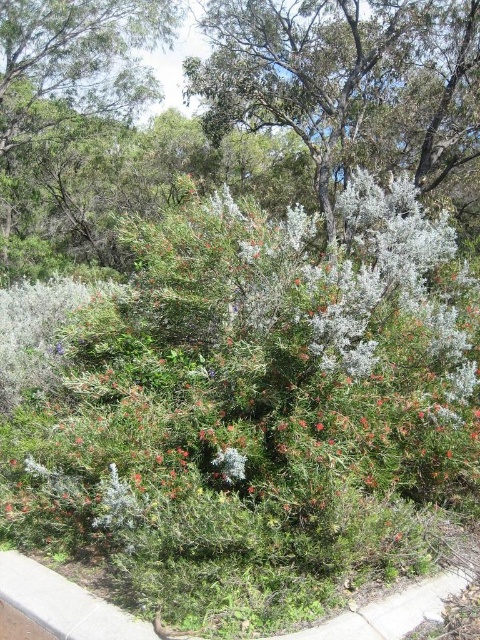
Who is more forward, [92,429] or [231,125]?

Point [92,429] is in front.

Does green leafy bush at center have a lesser height compared to white fluffy bush at upper center?

Incorrect, green leafy bush at center's height does not fall short of white fluffy bush at upper center's.

Does point (164, 273) lie in front of point (340, 172)?

Yes, it is.

The height and width of the screenshot is (640, 480). Find the location of `green leafy bush at center`. green leafy bush at center is located at coordinates (252, 387).

Which is above, white fluffy bush at upper center or green leafy tree at upper left?

white fluffy bush at upper center is higher up.

This screenshot has height=640, width=480. Describe the element at coordinates (348, 81) in the screenshot. I see `white fluffy bush at upper center` at that location.

This screenshot has height=640, width=480. What are the coordinates of `white fluffy bush at upper center` in the screenshot? It's located at (348, 81).

Is green leafy bush at center positioned behind green leafy tree at upper left?

No, green leafy bush at center is closer to the viewer.

Locate an element on the screen. Image resolution: width=480 pixels, height=640 pixels. green leafy bush at center is located at coordinates (252, 387).